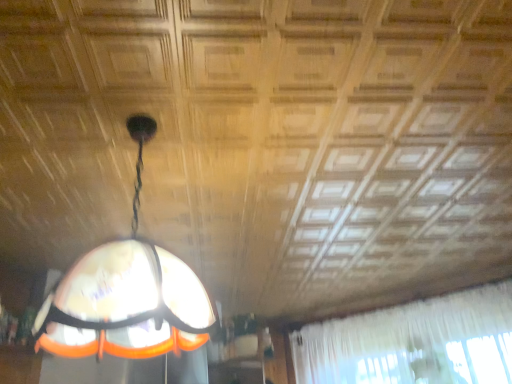
Question: Considering the positions of white sheer curtain at upper right and translucent glass lampshade at center in the image, is white sheer curtain at upper right wider or thinner than translucent glass lampshade at center?

Choices:
 (A) wide
 (B) thin

Answer: (B)

Question: From the image's perspective, is white sheer curtain at upper right above or below translucent glass lampshade at center?

Choices:
 (A) below
 (B) above

Answer: (A)

Question: Relative to translucent glass lampshade at center, is white sheer curtain at upper right in front or behind?

Choices:
 (A) behind
 (B) front

Answer: (A)

Question: Is translucent glass lampshade at center inside or outside of white sheer curtain at upper right?

Choices:
 (A) inside
 (B) outside

Answer: (B)

Question: From their relative heights in the image, would you say translucent glass lampshade at center is taller or shorter than white sheer curtain at upper right?

Choices:
 (A) short
 (B) tall

Answer: (A)

Question: From a real-world perspective, is translucent glass lampshade at center above or below white sheer curtain at upper right?

Choices:
 (A) above
 (B) below

Answer: (A)

Question: From the image's perspective, is translucent glass lampshade at center located above or below white sheer curtain at upper right?

Choices:
 (A) below
 (B) above

Answer: (B)